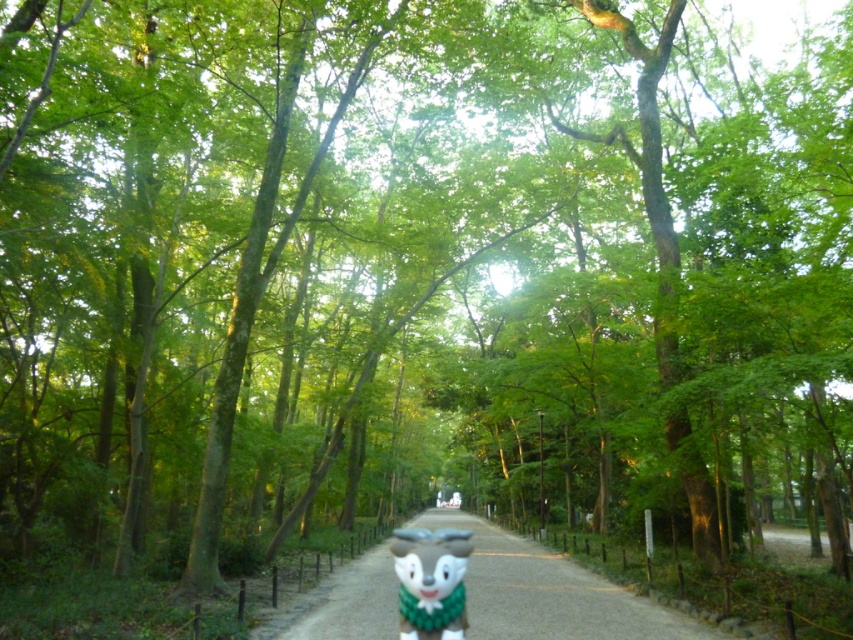
Can you confirm if smooth gravel path at center is positioned below green plush toy at center?

Indeed, smooth gravel path at center is positioned under green plush toy at center.

What do you see at coordinates (550, 593) in the screenshot? I see `smooth gravel path at center` at bounding box center [550, 593].

Locate an element on the screen. The width and height of the screenshot is (853, 640). smooth gravel path at center is located at coordinates (550, 593).